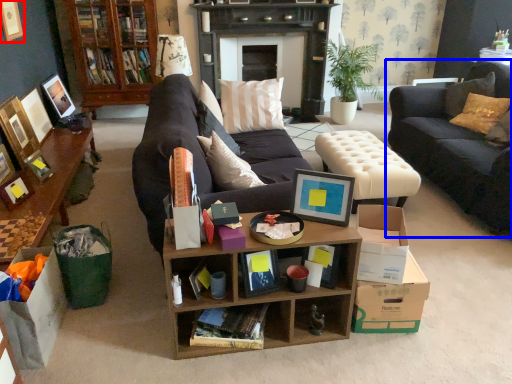
Question: Among these objects, which one is nearest to the camera, picture frame (highlighted by a red box) or studio couch (highlighted by a blue box)?

Choices:
 (A) picture frame
 (B) studio couch

Answer: (B)